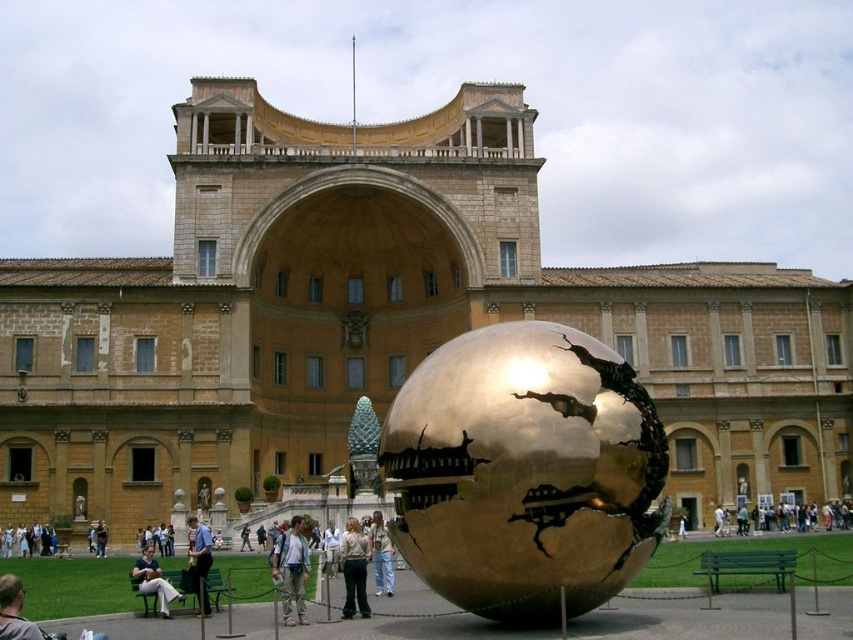
You are standing in front of the grand building and see the light blue jeans at center and the light blue denim jeans at center. Which one is positioned higher in the scene?

The light blue jeans at center is positioned higher than the light blue denim jeans at center.

You are a visitor standing in front of the grand building and see the light brown wooden bench at lower center and the light blue denim jeans at lower left. Which object is bigger in size?

The light brown wooden bench at lower center is larger in size compared to the light blue denim jeans at lower left.